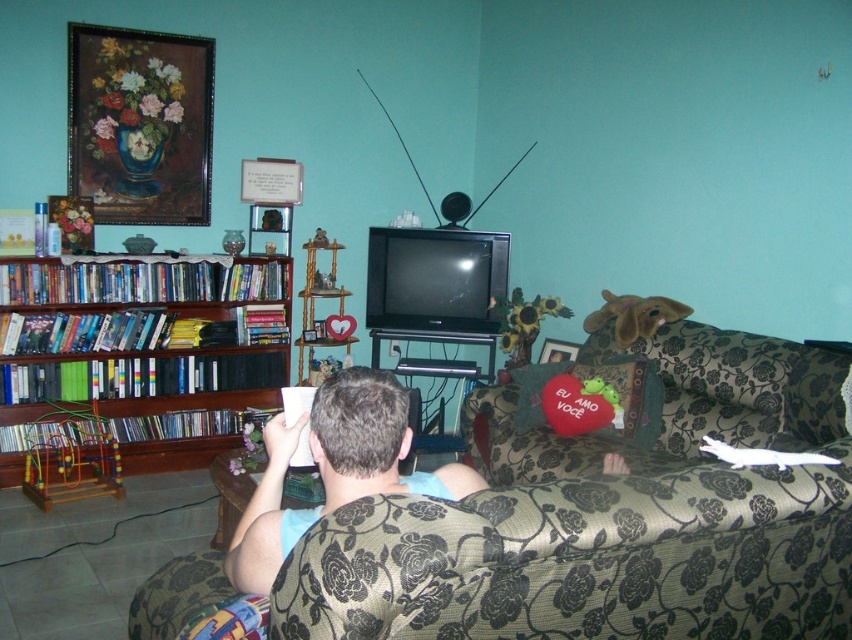
Who is higher up, floral-patterned fabric couch at center or woodenmaterial/texturebookshelf at left?

Positioned higher is woodenmaterial/texturebookshelf at left.

Does floral-patterned fabric couch at center appear on the left side of woodenmaterial/texturebookshelf at left?

No, floral-patterned fabric couch at center is not to the left of woodenmaterial/texturebookshelf at left.

At what (x,y) coordinates should I click in order to perform the action: click on floral-patterned fabric couch at center. Please return your answer as a coordinate pair (x, y). The width and height of the screenshot is (852, 640). Looking at the image, I should click on (609, 522).

Can you confirm if woodenmaterial/texturebookshelf at left is thinner than blue cotton shirt at center?

No, woodenmaterial/texturebookshelf at left is not thinner than blue cotton shirt at center.

Which is in front, point (87, 266) or point (323, 388)?

Point (323, 388)

Is point (181, 273) in front of point (283, 426)?

No.

The image size is (852, 640). In order to click on woodenmaterial/texturebookshelf at left in this screenshot , I will do `click(158, 348)`.

Which is more to the right, floral-patterned fabric couch at center or blue cotton shirt at center?

floral-patterned fabric couch at center is more to the right.

Can you confirm if floral-patterned fabric couch at center is positioned to the left of blue cotton shirt at center?

Incorrect, floral-patterned fabric couch at center is not on the left side of blue cotton shirt at center.

Who is more distant from viewer, (813,481) or (396,435)?

The point (396,435) is behind.

At what (x,y) coordinates should I click in order to perform the action: click on floral-patterned fabric couch at center. Please return your answer as a coordinate pair (x, y). The image size is (852, 640). Looking at the image, I should click on (609, 522).